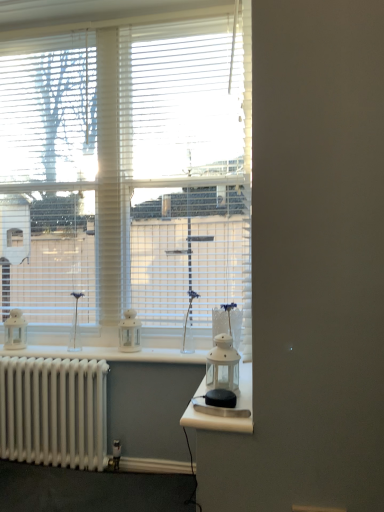
At what (x,y) coordinates should I click in order to perform the action: click on free location above white metallic radiator at lower left (from a real-world perspective). Please return your answer as a coordinate pair (x, y). This screenshot has height=512, width=384. Looking at the image, I should click on pos(57,357).